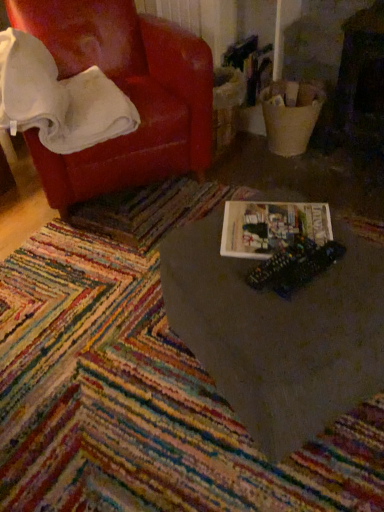
Identify the location of vacant space to the right of metallic plastic toy at center. (357, 266).